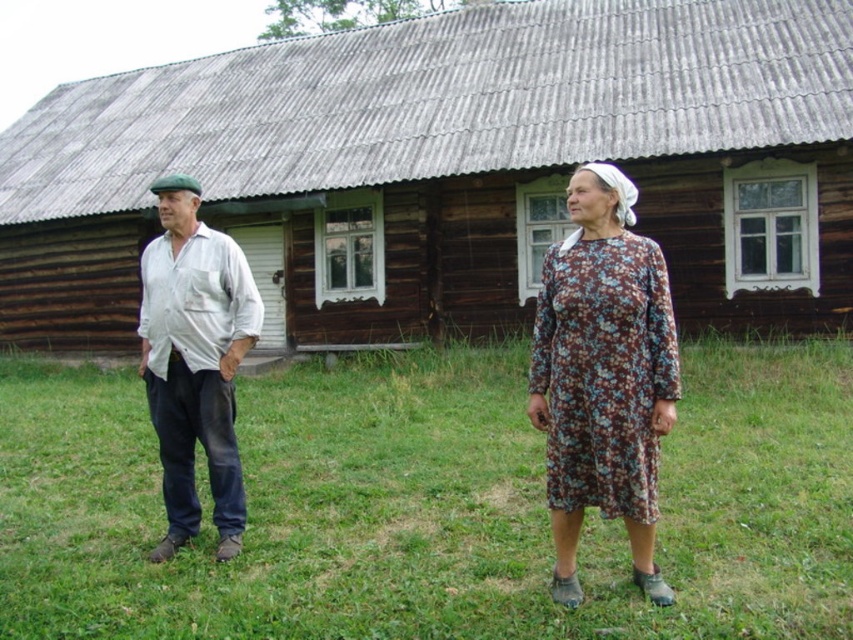
Question: Which point is farther from the camera taking this photo?

Choices:
 (A) (711, 412)
 (B) (631, 168)
 (C) (579, 483)

Answer: (B)

Question: Which point is farther to the camera?

Choices:
 (A) (223, 356)
 (B) (646, 458)

Answer: (A)

Question: Observing the image, what is the correct spatial positioning of wooden hut at center in reference to white cotton shirt at left?

Choices:
 (A) below
 (B) above

Answer: (B)

Question: Can you confirm if floral cotton dress at center is smaller than white cotton shirt at left?

Choices:
 (A) yes
 (B) no

Answer: (A)

Question: Which point is farther from the camera taking this photo?

Choices:
 (A) (107, 406)
 (B) (247, 116)
 (C) (166, 250)

Answer: (B)

Question: Is wooden hut at center above green grass at center?

Choices:
 (A) yes
 (B) no

Answer: (A)